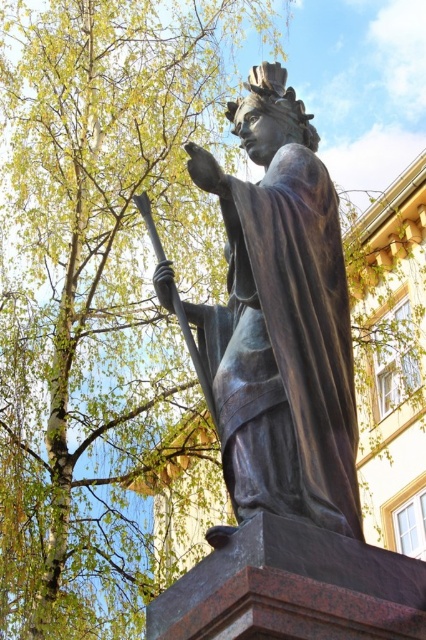
Consider the image. You are an art student trying to sketch the shiny bronze statue at center. You notice a green leafy tree at upper left in the background. From your perspective, which object is positioned to the left of the other?

The green leafy tree at upper left is to the left of the shiny bronze statue at center.

You are an art student trying to sketch the bronze statue. You notice the green leafy tree at upper left and the shiny bronze statue at center. Which object is closer to you, the observer?

The green leafy tree at upper left is closer to you because the shiny bronze statue at center is behind it.

You are a photographer planning to capture the shiny bronze statue at center without any obstructions from the green leafy tree at upper left. Based on the scene description, can you determine if the tree will block the view of the statue?

The green leafy tree at upper left is taller than the shiny bronze statue at center, so the tree may block part of the statue depending on the angle and distance. To avoid obstruction, position yourself where the tree is out of frame or behind you.